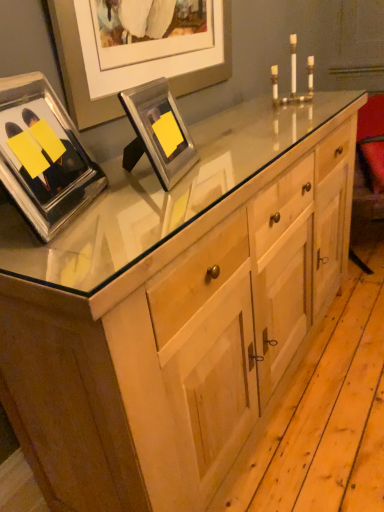
Locate an element on the screen. free spot to the right of clear glass picture frame at upper left, which is the second picture frame in right-to-left order is located at coordinates (147, 211).